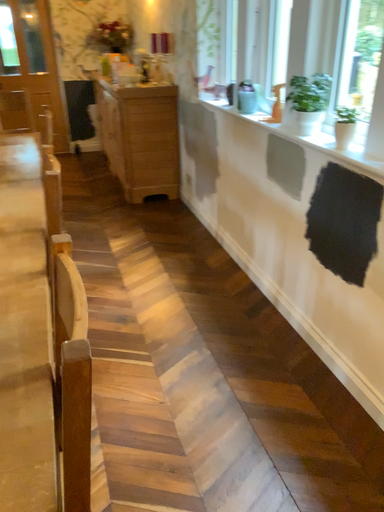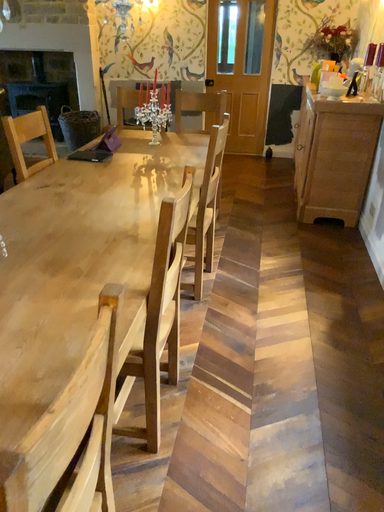
Question: How did the camera likely rotate when shooting the video?

Choices:
 (A) rotated right
 (B) rotated left

Answer: (B)